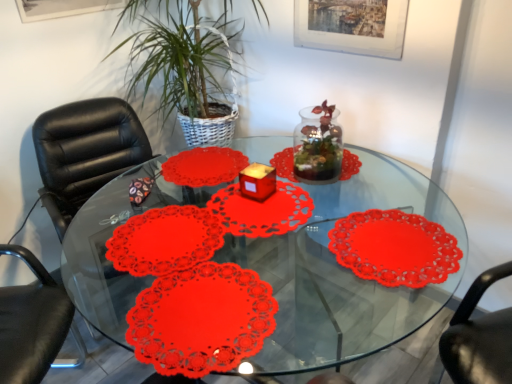
The image size is (512, 384). In order to click on vacant space in between transparent glass jar at center and matte red candle holder at center in this screenshot , I will do `click(283, 193)`.